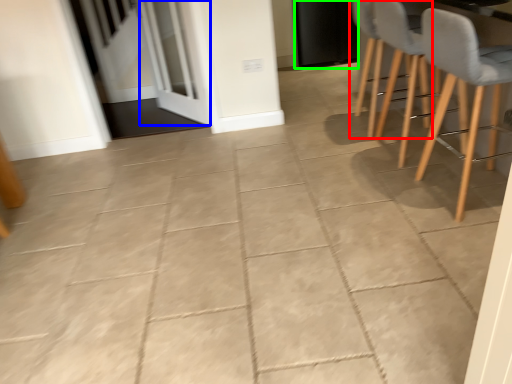
Question: Which is farther away from chair (highlighted by a red box)? screen door (highlighted by a blue box) or door (highlighted by a green box)?

Choices:
 (A) screen door
 (B) door

Answer: (A)